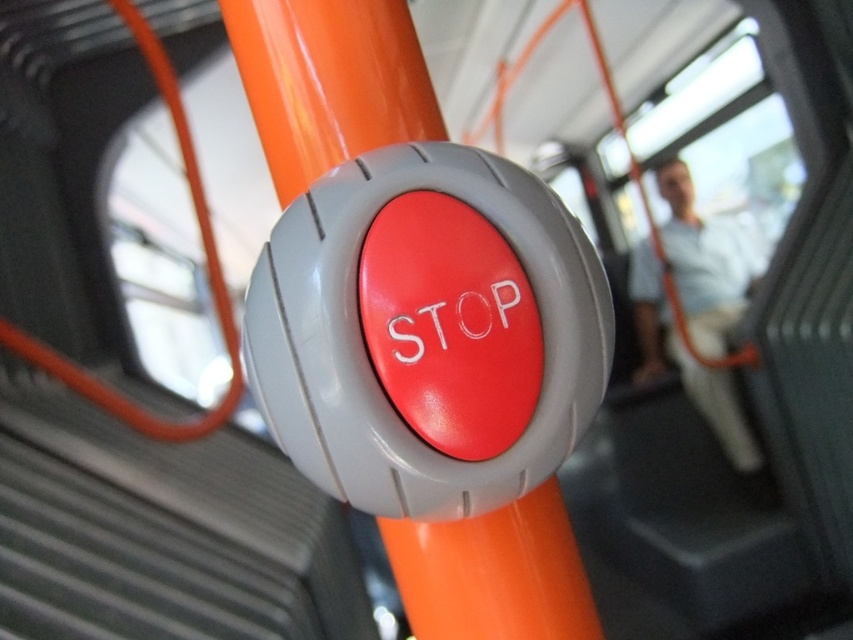
Question: Does matte orange pole at center appear under white fabric coach at upper center?

Choices:
 (A) yes
 (B) no

Answer: (B)

Question: Which object is closer to the camera taking this photo?

Choices:
 (A) matte orange pole at center
 (B) white fabric coach at upper center

Answer: (A)

Question: Is matte orange pole at center to the left of white fabric coach at upper center from the viewer's perspective?

Choices:
 (A) yes
 (B) no

Answer: (A)

Question: In this image, where is matte orange pole at center located relative to white fabric coach at upper center?

Choices:
 (A) right
 (B) left

Answer: (B)